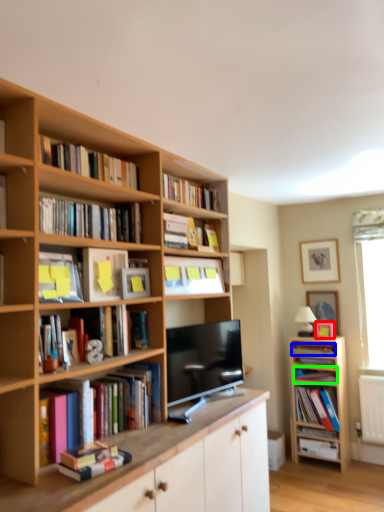
Question: Which object is the closest to the picture frame (highlighted by a red box)? Choose among these: book (highlighted by a blue box) or book (highlighted by a green box).

Choices:
 (A) book
 (B) book

Answer: (A)